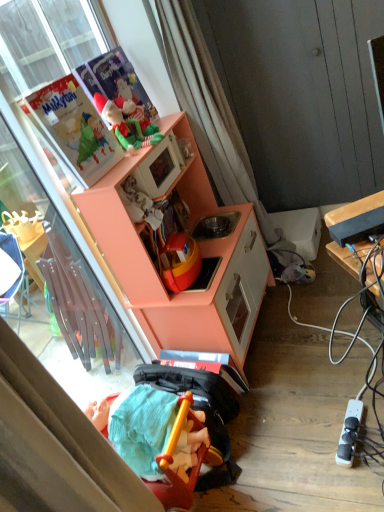
Question: Should I look upward or downward to see rubberized plastic toy at lower center, the 2th toy from the back?

Choices:
 (A) down
 (B) up

Answer: (A)

Question: Can you confirm if black plastic tv at right is positioned to the left of rubberized plastic toy at lower center, which appears as the 1th toy when ordered from the bottom?

Choices:
 (A) yes
 (B) no

Answer: (B)

Question: Could rubberized plastic toy at lower center, the 2th toy from the back, be considered to be inside black plastic tv at right?

Choices:
 (A) no
 (B) yes

Answer: (A)

Question: From the image's perspective, is black plastic tv at right over rubberized plastic toy at lower center, the 2th toy from the back?

Choices:
 (A) no
 (B) yes

Answer: (B)

Question: Is black plastic tv at right not within rubberized plastic toy at lower center, placed as the first toy when sorted from front to back?

Choices:
 (A) yes
 (B) no

Answer: (A)

Question: Would you consider black plastic tv at right to be distant from rubberized plastic toy at lower center, which appears as the 1th toy when ordered from the bottom?

Choices:
 (A) no
 (B) yes

Answer: (A)

Question: From a real-world perspective, is black plastic tv at right under rubberized plastic toy at lower center, the 2th toy from the back?

Choices:
 (A) yes
 (B) no

Answer: (B)

Question: From the image's perspective, would you say white plastic power outlet at lower right is shown under transparent glass door at upper left?

Choices:
 (A) no
 (B) yes

Answer: (B)

Question: Can you confirm if white plastic power outlet at lower right is shorter than transparent glass door at upper left?

Choices:
 (A) yes
 (B) no

Answer: (A)

Question: Is white plastic power outlet at lower right outside transparent glass door at upper left?

Choices:
 (A) yes
 (B) no

Answer: (A)

Question: Can you confirm if white plastic power outlet at lower right is taller than transparent glass door at upper left?

Choices:
 (A) yes
 (B) no

Answer: (B)

Question: Considering the relative sizes of white plastic power outlet at lower right and transparent glass door at upper left in the image provided, is white plastic power outlet at lower right wider than transparent glass door at upper left?

Choices:
 (A) no
 (B) yes

Answer: (B)

Question: Is white plastic power outlet at lower right facing towards transparent glass door at upper left?

Choices:
 (A) yes
 (B) no

Answer: (B)

Question: Can you confirm if white plastic power outlet at lower right is thinner than peach matte cabinet at upper left?

Choices:
 (A) yes
 (B) no

Answer: (A)